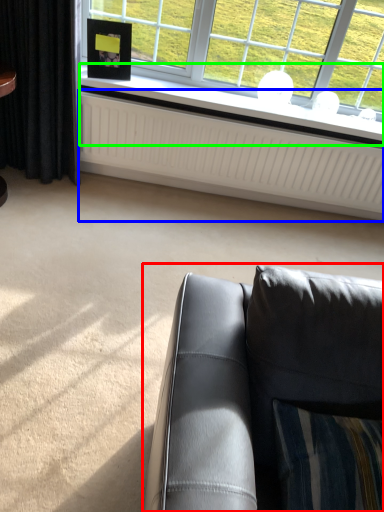
Question: Considering the real-world distances, which object is farthest from studio couch (highlighted by a red box)? radiator (highlighted by a blue box) or window sill (highlighted by a green box)?

Choices:
 (A) radiator
 (B) window sill

Answer: (B)